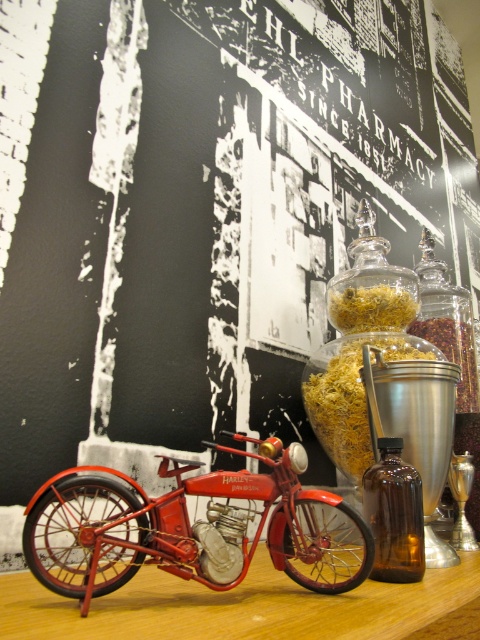
Question: Which point is closer to the camera?

Choices:
 (A) (59, 518)
 (B) (460, 420)
 (C) (387, 336)
 (D) (382, 456)

Answer: (A)

Question: Is translucent glass jar at center smaller than yellow shredded food at center?

Choices:
 (A) yes
 (B) no

Answer: (B)

Question: Which point appears farthest from the camera in this image?

Choices:
 (A) (354, 374)
 (B) (359, 568)

Answer: (A)

Question: Which point is farther to the camera?

Choices:
 (A) (344, 340)
 (B) (276, 531)
 (C) (445, 349)
 (D) (396, 440)

Answer: (C)

Question: Considering the relative positions of metallic red motorcycle at center and brown glass bottle at right in the image provided, where is metallic red motorcycle at center located with respect to brown glass bottle at right?

Choices:
 (A) left
 (B) right

Answer: (A)

Question: Can you confirm if brown glass bottle at right is positioned above brown granular spice at center right?

Choices:
 (A) no
 (B) yes

Answer: (A)